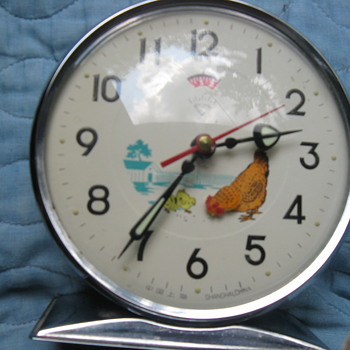
Identify the location of metal rim of clock. The height and width of the screenshot is (350, 350). (72, 254).